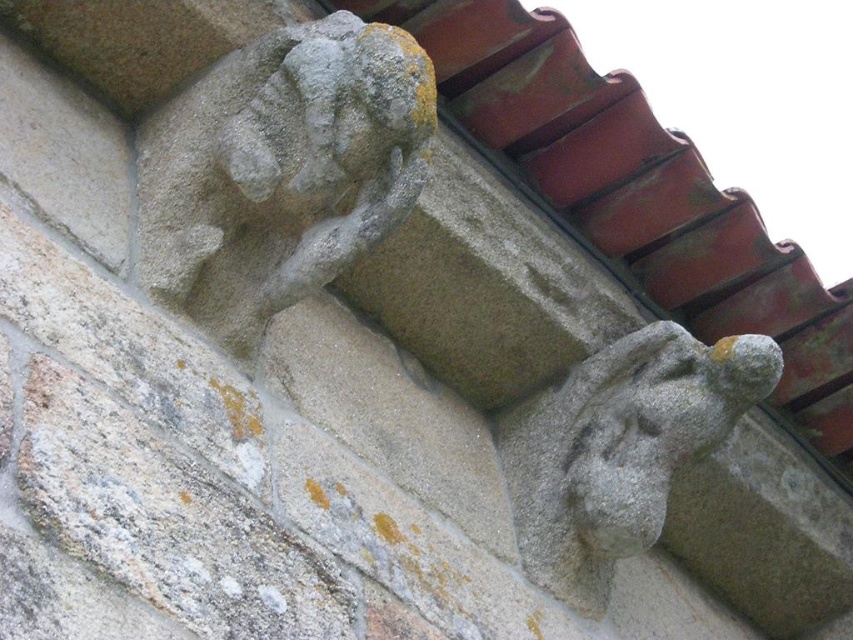
Question: Which point is farther to the camera?

Choices:
 (A) (509, 410)
 (B) (239, 120)

Answer: (A)

Question: Does gray stone gargoyle at upper left have a greater width compared to gray stone gargoyle at lower right?

Choices:
 (A) no
 (B) yes

Answer: (B)

Question: Which object appears closest to the camera in this image?

Choices:
 (A) gray stone gargoyle at lower right
 (B) gray stone gargoyle at upper left

Answer: (B)

Question: Does gray stone gargoyle at upper left appear on the left side of gray stone gargoyle at lower right?

Choices:
 (A) no
 (B) yes

Answer: (B)

Question: Is gray stone gargoyle at upper left thinner than gray stone gargoyle at lower right?

Choices:
 (A) no
 (B) yes

Answer: (A)